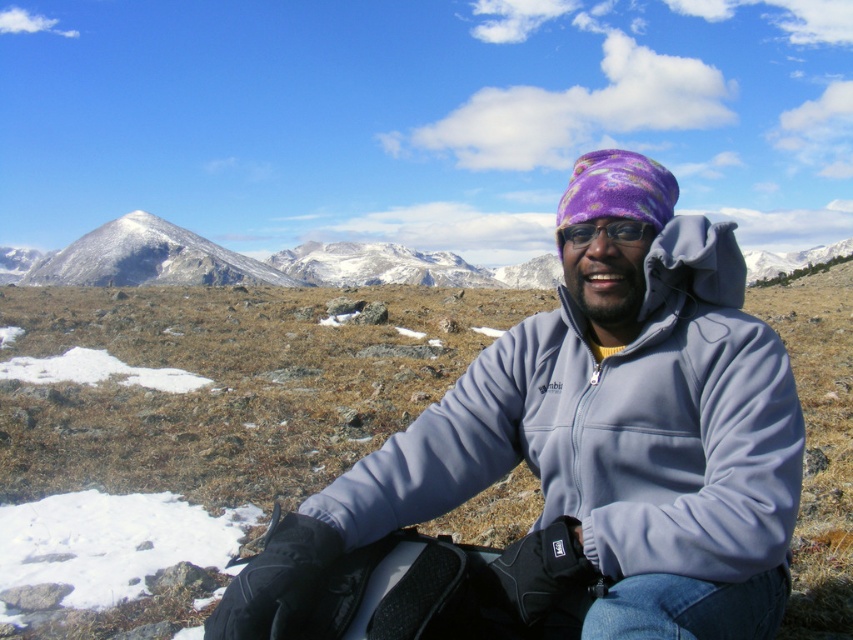
From the picture: You are planning to take a photo of the snowy rock mountain at left and the purple fleece goggles at center. Which object should you focus on first if you want to capture both in a single frame without moving the camera?

The snowy rock mountain at left is bigger than the purple fleece goggles at center, so you should focus on the snowy rock mountain at left first to ensure it fits properly in the frame before adjusting for the smaller object.